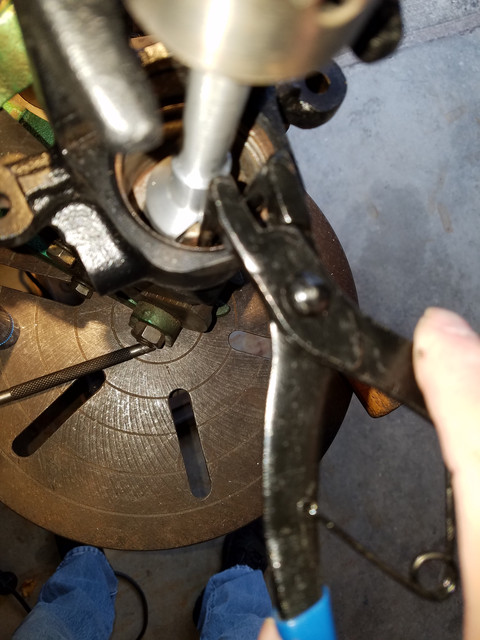
Image resolution: width=480 pixels, height=640 pixels. What are the coordinates of `floor` in the screenshot? It's located at (367, 513).